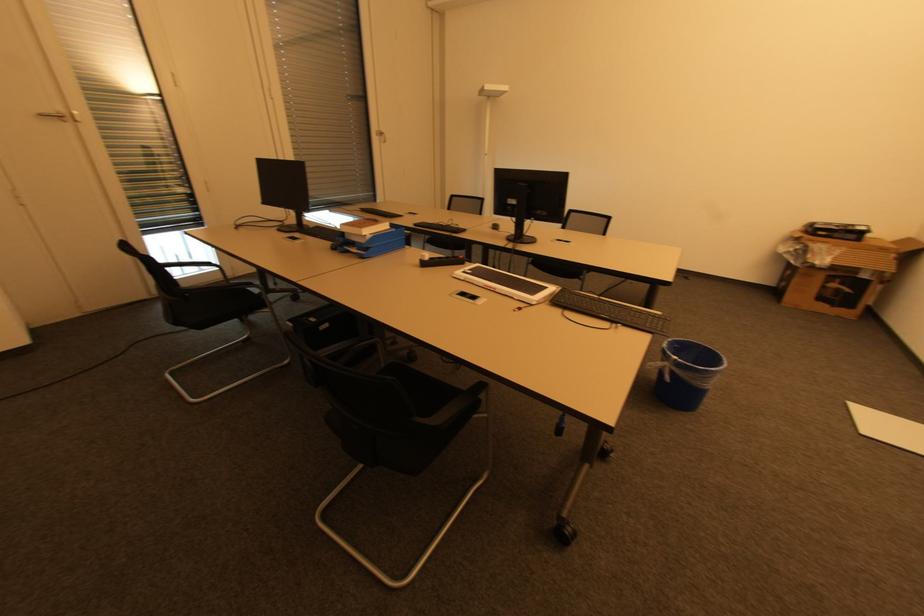
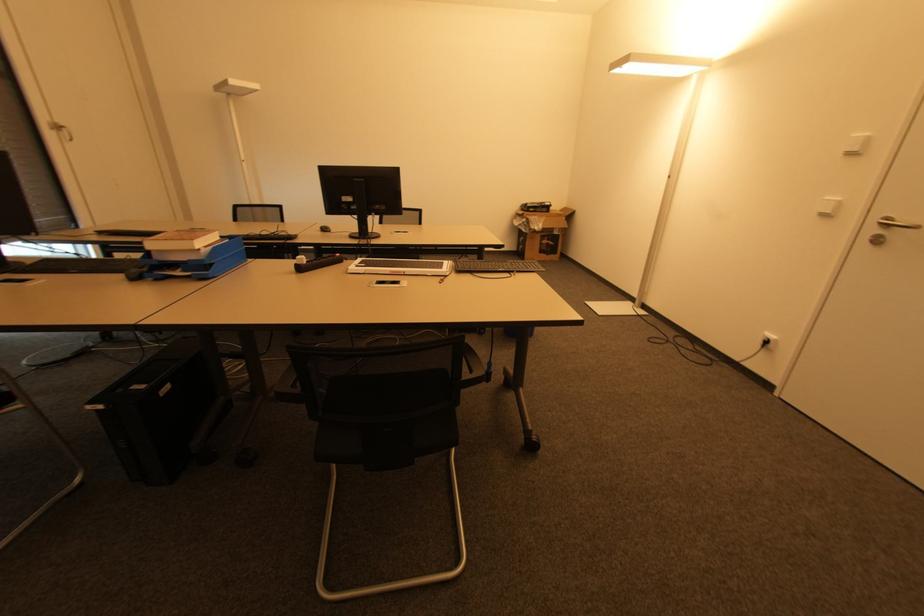
The point at (356, 251) is marked in the first image. Where is the corresponding point in the second image?

(178, 274)